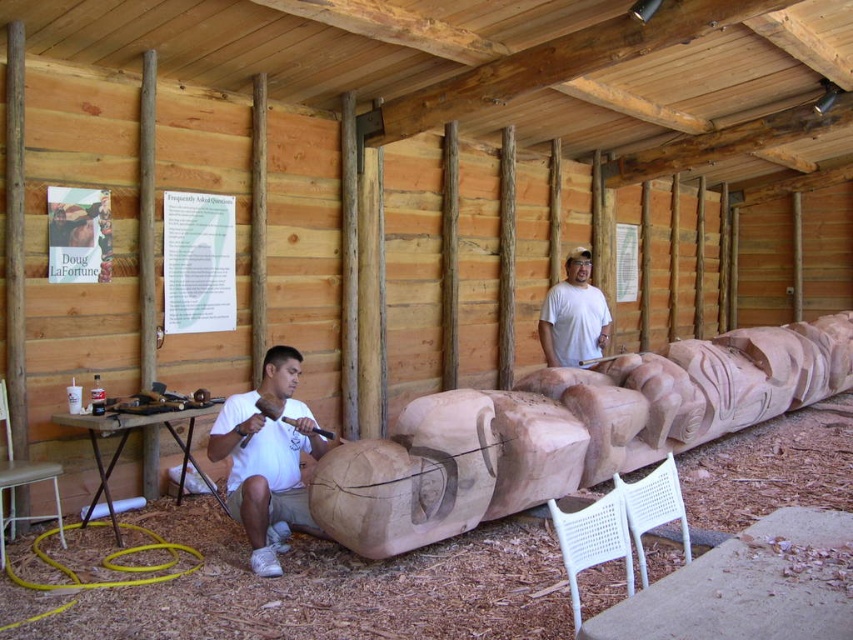
Is white matte shirt at lower left further to the viewer compared to metallic stool at lower left?

No, it is not.

Is white matte shirt at lower left taller than metallic stool at lower left?

Indeed, white matte shirt at lower left has a greater height compared to metallic stool at lower left.

Locate an element on the screen. white matte shirt at lower left is located at coordinates (268, 458).

Which is behind, point (625, 516) or point (105, 403)?

The point (105, 403) is more distant.

Who is lower down, white plastic chair at lower right or brushed metal chisel at left?

white plastic chair at lower right is lower down.

Locate an element on the screen. The width and height of the screenshot is (853, 640). white plastic chair at lower right is located at coordinates (653, 508).

Is white matte shirt at lower left shorter than white plastic chair at lower right?

Incorrect, white matte shirt at lower left's height does not fall short of white plastic chair at lower right's.

Where is `white matte shirt at lower left`? white matte shirt at lower left is located at coordinates (268, 458).

At what (x,y) coordinates should I click in order to perform the action: click on white matte shirt at lower left. Please return your answer as a coordinate pair (x, y). The width and height of the screenshot is (853, 640). Looking at the image, I should click on (268, 458).